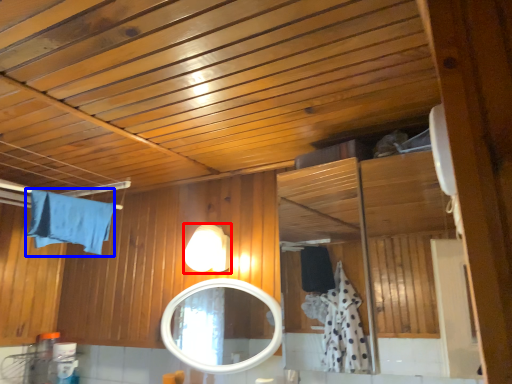
Question: Among these objects, which one is nearest to the camera, light fixture (highlighted by a red box) or bath towel (highlighted by a blue box)?

Choices:
 (A) light fixture
 (B) bath towel

Answer: (B)